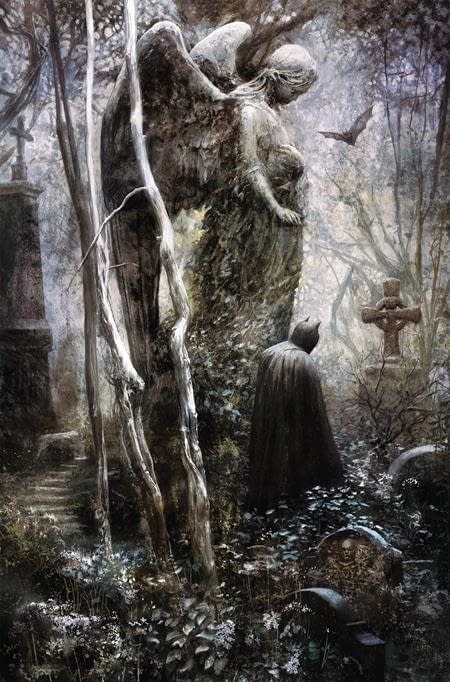
At what (x,y) coordinates should I click in order to perform the action: click on stairs. Please return your answer as a coordinate pair (x, y). This screenshot has width=450, height=682. Looking at the image, I should click on (58, 490).